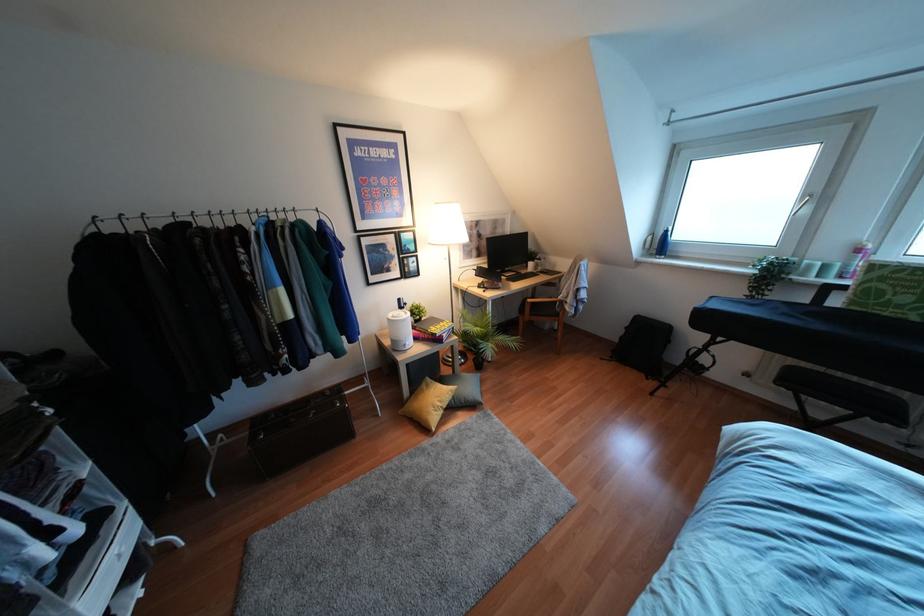
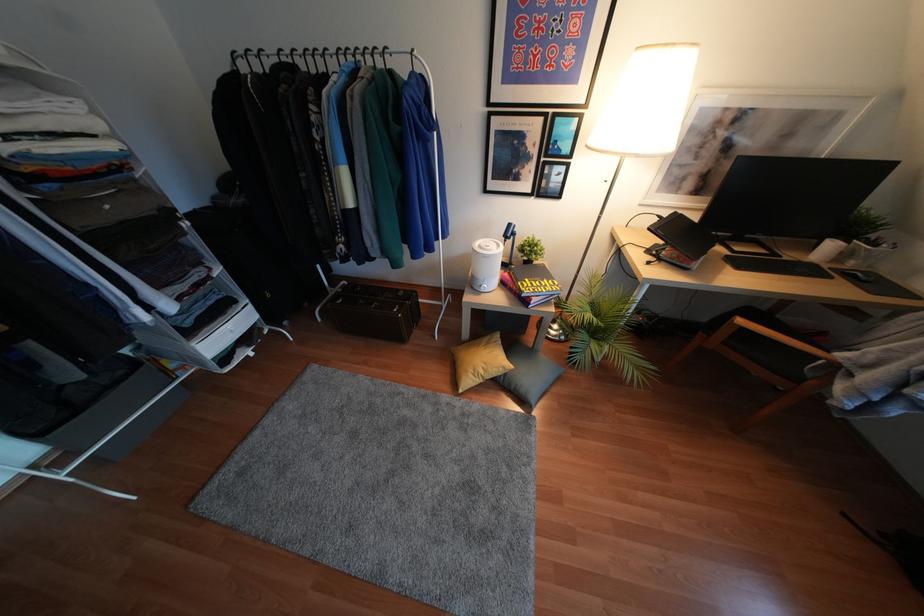
The point at (496, 345) is marked in the first image. Where is the corresponding point in the second image?

(604, 357)